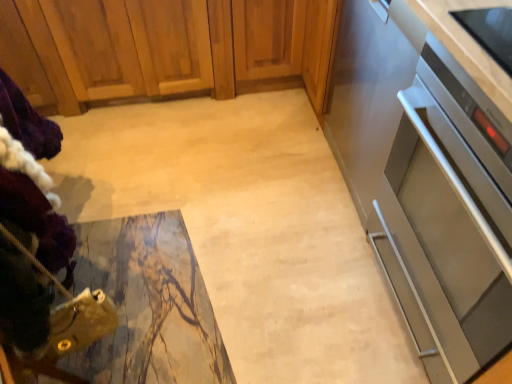
Question: From a real-world perspective, is satin silver oven at right under wooden cabinet at upper left?

Choices:
 (A) yes
 (B) no

Answer: (B)

Question: Is satin silver oven at right bigger than wooden cabinet at upper left?

Choices:
 (A) yes
 (B) no

Answer: (B)

Question: Does satin silver oven at right come in front of wooden cabinet at upper left?

Choices:
 (A) no
 (B) yes

Answer: (B)

Question: Are satin silver oven at right and wooden cabinet at upper left far apart?

Choices:
 (A) yes
 (B) no

Answer: (A)

Question: Can you confirm if satin silver oven at right is smaller than wooden cabinet at upper left?

Choices:
 (A) yes
 (B) no

Answer: (A)

Question: From a real-world perspective, is wooden cabinet at upper left above or below satin silver oven at right?

Choices:
 (A) below
 (B) above

Answer: (A)

Question: Considering their positions, is wooden cabinet at upper left located in front of or behind satin silver oven at right?

Choices:
 (A) front
 (B) behind

Answer: (B)

Question: Is wooden cabinet at upper left taller or shorter than satin silver oven at right?

Choices:
 (A) short
 (B) tall

Answer: (A)

Question: Choose the correct answer: Is wooden cabinet at upper left inside satin silver oven at right or outside it?

Choices:
 (A) inside
 (B) outside

Answer: (B)

Question: Does point (374, 76) appear closer or farther from the camera than point (165, 43)?

Choices:
 (A) closer
 (B) farther

Answer: (B)

Question: Considering the positions of stainless steel oven at right and wooden cabinet at upper left in the image, is stainless steel oven at right wider or thinner than wooden cabinet at upper left?

Choices:
 (A) thin
 (B) wide

Answer: (A)

Question: Do you think stainless steel oven at right is within wooden cabinet at upper left, or outside of it?

Choices:
 (A) inside
 (B) outside

Answer: (B)

Question: In terms of size, does stainless steel oven at right appear bigger or smaller than wooden cabinet at upper left?

Choices:
 (A) big
 (B) small

Answer: (B)

Question: Considering their positions, is stainless steel oven at right located in front of or behind satin silver oven at right?

Choices:
 (A) behind
 (B) front

Answer: (A)

Question: Is stainless steel oven at right wider or thinner than satin silver oven at right?

Choices:
 (A) wide
 (B) thin

Answer: (A)